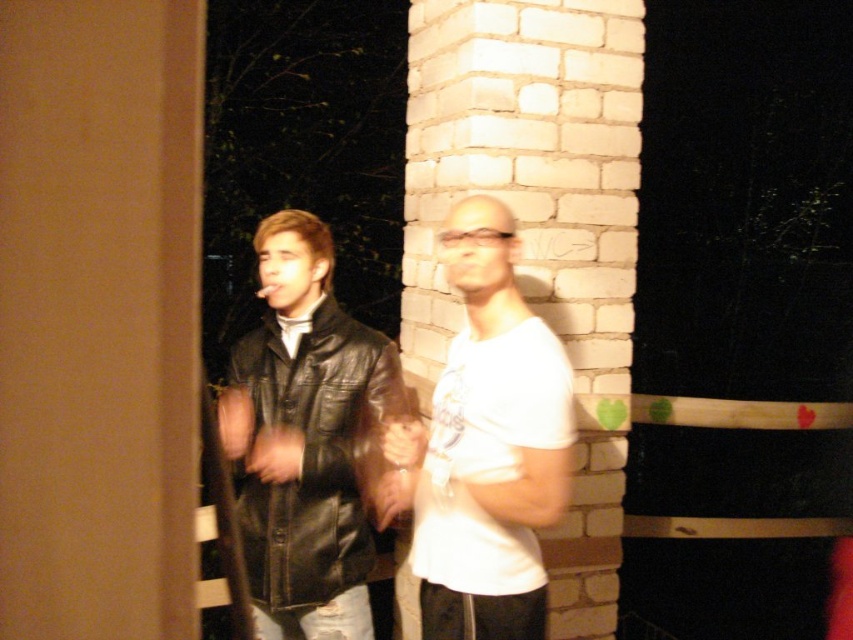
You are a photographer trying to capture the best shot of the scene. You notice a specific point marked at coordinates (486, 445). Based on the scene description, where would this point most likely be located on the person wearing the white matte t shirt at center?

The point (486, 445) is on the white matte t shirt at center.